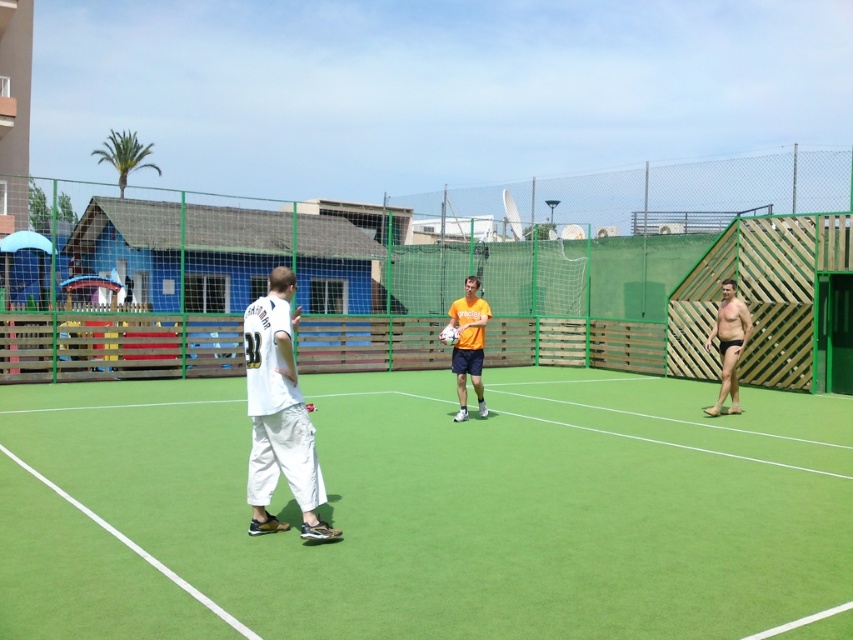
Where is the green artificial turf at center located in the tennis court scene?

The green artificial turf at center is located at point (427, 509) in the tennis court scene.

You are a photographer standing outside the tennis court. You want to take a photo that includes both the green artificial turf at center and the orange matte shirt at center. Which object should be placed closer to the camera to ensure both are fully visible in the frame?

The orange matte shirt at center should be placed closer to the camera because the green artificial turf at center is wider than the orange matte shirt at center, so positioning the shirt closer will help both fit within the photo frame.

You are a tennis ball that just bounced near the center of the court. You want to roll towards the player wearing the orange matte shirt at center and black matte shorts at right. Which direction should you go first?

The orange matte shirt at center is to the left of black matte shorts at right, so you should first roll to the left towards the orange matte shirt at center.